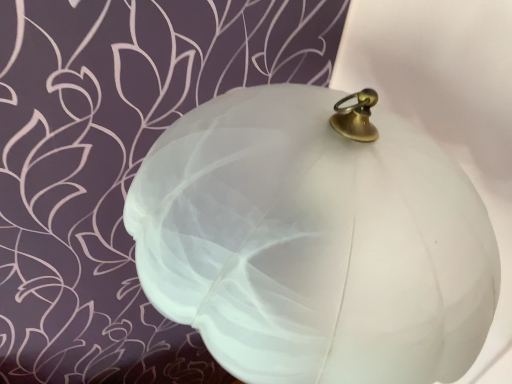
You are a GUI agent. You are given a task and a screenshot of the screen. Output one action in this format:
    pyautogui.click(x=<x>, y=<y>)
    Task: Click on the frosted glass lampshade at center
    This screenshot has width=512, height=384.
    Given the screenshot: What is the action you would take?
    pyautogui.click(x=314, y=243)

Image resolution: width=512 pixels, height=384 pixels. What do you see at coordinates (314, 243) in the screenshot? I see `frosted glass lampshade at center` at bounding box center [314, 243].

You are a GUI agent. You are given a task and a screenshot of the screen. Output one action in this format:
    pyautogui.click(x=<x>, y=<y>)
    Task: Click on the frosted glass lampshade at center
    The width and height of the screenshot is (512, 384).
    Given the screenshot: What is the action you would take?
    pyautogui.click(x=314, y=243)